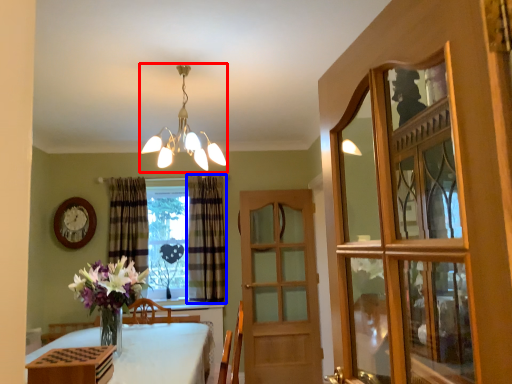
Question: Among these objects, which one is farthest to the camera, lamp (highlighted by a red box) or curtain (highlighted by a blue box)?

Choices:
 (A) lamp
 (B) curtain

Answer: (B)